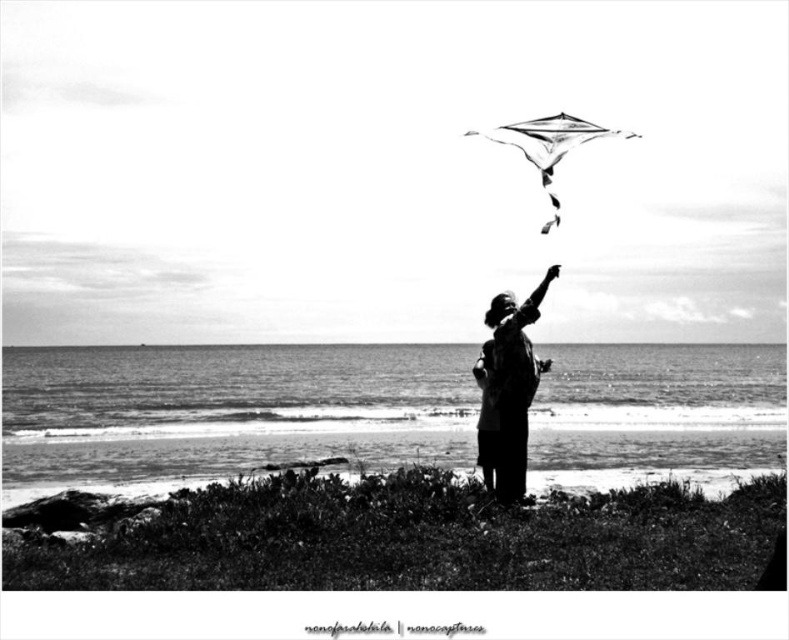
You are a photographer trying to capture the scene from the shore. You notice the dark fabric shirt at center and the transparent plastic kite at upper center. Which object appears narrower in the photo?

The dark fabric shirt at center appears narrower because it is thinner than the transparent plastic kite at upper center.

In the scene shown: You are a photographer trying to capture the scene. You see the dark fabric shirt at center and the transparent plastic kite at upper center. Which object is more to the left?

The dark fabric shirt at center is more to the left because it is positioned on the left side of the transparent plastic kite at upper center.

You are a photographer trying to capture the scene of the dark fabric shirt at center and the transparent plastic kite at upper center. Based on their sizes, which object should you focus on first to ensure it is in frame before the other?

The dark fabric shirt at center is smaller than the transparent plastic kite at upper center, so you should focus on the transparent plastic kite at upper center first since it is larger and might be easier to spot and frame initially.